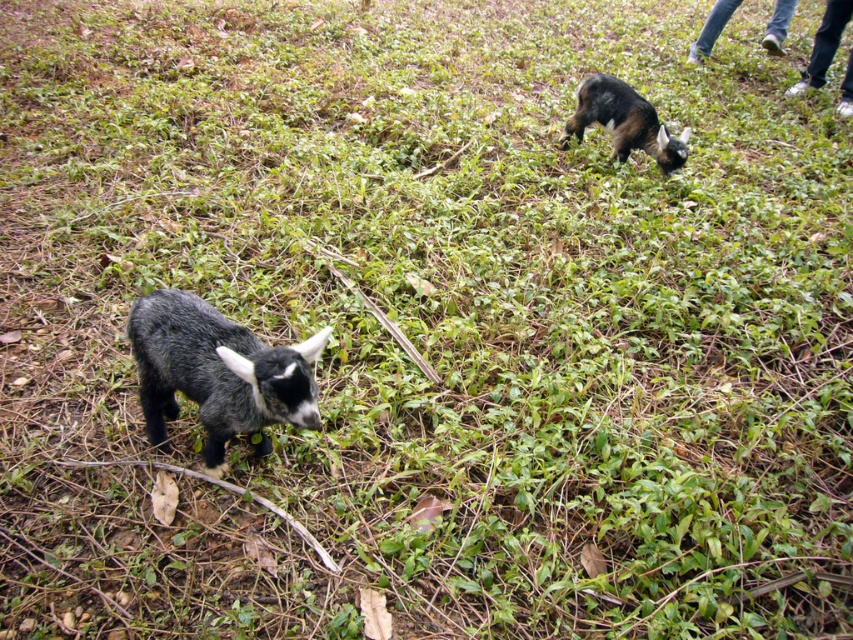
Question: Among these objects, which one is nearest to the camera?

Choices:
 (A) dark brown fur goat at upper right
 (B) white fabric pants at upper right
 (C) blue jeans at upper right

Answer: (A)

Question: Is white fabric pants at upper right to the right of blue jeans at upper right from the viewer's perspective?

Choices:
 (A) yes
 (B) no

Answer: (A)

Question: Is dark brown fur goat at upper right wider than blue jeans at upper right?

Choices:
 (A) yes
 (B) no

Answer: (A)

Question: Which object appears farthest from the camera in this image?

Choices:
 (A) white fabric pants at upper right
 (B) blue jeans at upper right
 (C) dark brown fur goat at upper right
 (D) shiny black goat at lower left

Answer: (B)

Question: Is shiny black goat at lower left smaller than blue jeans at upper right?

Choices:
 (A) no
 (B) yes

Answer: (B)

Question: Which point is closer to the camera taking this photo?

Choices:
 (A) (714, 29)
 (B) (665, 154)

Answer: (B)